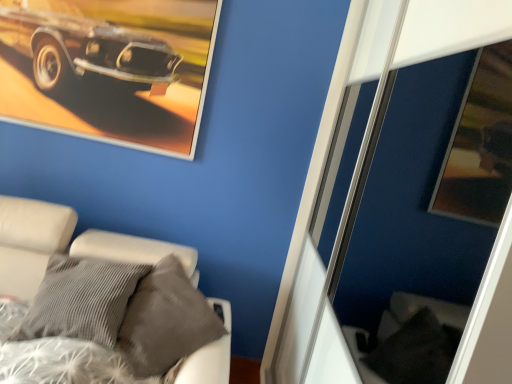
Question: Is metallic silver picture frame at upper left outside white fabric bed at lower left?

Choices:
 (A) no
 (B) yes

Answer: (B)

Question: Is metallic silver picture frame at upper left beside white fabric bed at lower left?

Choices:
 (A) yes
 (B) no

Answer: (B)

Question: Considering the relative sizes of metallic silver picture frame at upper left and white fabric bed at lower left in the image provided, is metallic silver picture frame at upper left shorter than white fabric bed at lower left?

Choices:
 (A) no
 (B) yes

Answer: (B)

Question: From a real-world perspective, is metallic silver picture frame at upper left physically above white fabric bed at lower left?

Choices:
 (A) no
 (B) yes

Answer: (B)

Question: Is metallic silver picture frame at upper left aimed at white fabric bed at lower left?

Choices:
 (A) no
 (B) yes

Answer: (A)

Question: Considering the relative sizes of metallic silver picture frame at upper left and white fabric bed at lower left in the image provided, is metallic silver picture frame at upper left smaller than white fabric bed at lower left?

Choices:
 (A) yes
 (B) no

Answer: (A)

Question: From a real-world perspective, is white fabric bed at lower left positioned over metallic silver picture frame at upper left based on gravity?

Choices:
 (A) no
 (B) yes

Answer: (A)

Question: Is white fabric bed at lower left closer to camera compared to metallic silver picture frame at upper left?

Choices:
 (A) no
 (B) yes

Answer: (B)

Question: From the image's perspective, does white fabric bed at lower left appear lower than metallic silver picture frame at upper left?

Choices:
 (A) yes
 (B) no

Answer: (A)

Question: Is white fabric bed at lower left positioned with its back to metallic silver picture frame at upper left?

Choices:
 (A) yes
 (B) no

Answer: (B)

Question: Is white fabric bed at lower left not near metallic silver picture frame at upper left?

Choices:
 (A) no
 (B) yes

Answer: (A)

Question: Does white fabric bed at lower left turn towards metallic silver picture frame at upper left?

Choices:
 (A) no
 (B) yes

Answer: (A)

Question: From a real-world perspective, is metallic silver picture frame at upper left above or below white fabric bed at lower left?

Choices:
 (A) below
 (B) above

Answer: (B)